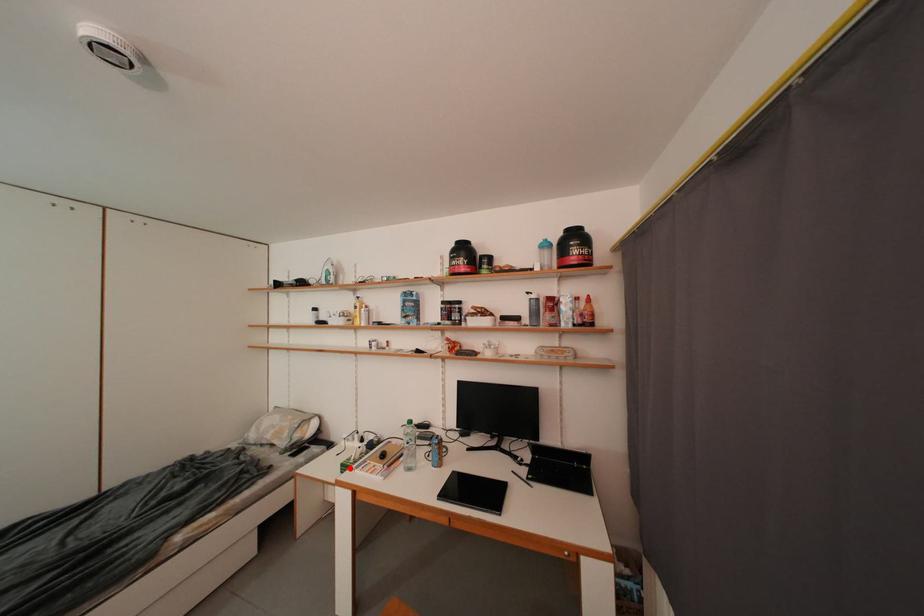
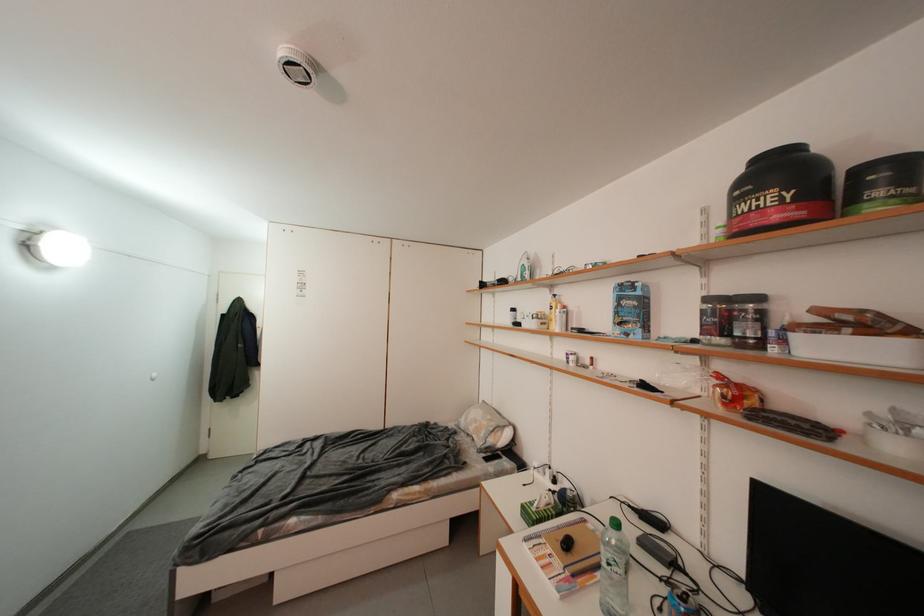
Find the pixel in the second image that matches the highlighted location in the first image.

(530, 509)